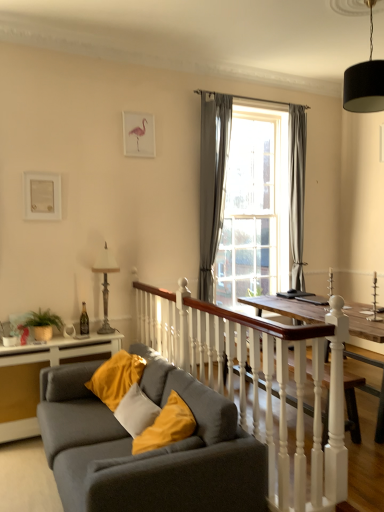
Question: Can you see gray fabric curtain at center, the second curtain from the back, touching black fabric lampshade at upper right?

Choices:
 (A) yes
 (B) no

Answer: (B)

Question: Does gray fabric curtain at center, the 1th curtain positioned from the front, have a greater width compared to black fabric lampshade at upper right?

Choices:
 (A) no
 (B) yes

Answer: (A)

Question: Does gray fabric curtain at center, the 1th curtain positioned from the front, appear on the left side of black fabric lampshade at upper right?

Choices:
 (A) yes
 (B) no

Answer: (A)

Question: From the image's perspective, is gray fabric curtain at center, arranged as the second curtain when viewed from the right, located beneath black fabric lampshade at upper right?

Choices:
 (A) yes
 (B) no

Answer: (A)

Question: Is gray fabric curtain at center, arranged as the second curtain when viewed from the right, positioned with its back to black fabric lampshade at upper right?

Choices:
 (A) yes
 (B) no

Answer: (B)

Question: Would you say metallic silver lamp at left is to the left or to the right of white matte picture frame at upper left, the 1th picture frame from the bottom, in the picture?

Choices:
 (A) left
 (B) right

Answer: (B)

Question: Based on their sizes in the image, would you say metallic silver lamp at left is bigger or smaller than white matte picture frame at upper left, which is counted as the second picture frame, starting from the top?

Choices:
 (A) big
 (B) small

Answer: (A)

Question: In the image, is metallic silver lamp at left positioned in front of or behind white matte picture frame at upper left, which is the 2th picture frame in right-to-left order?

Choices:
 (A) front
 (B) behind

Answer: (B)

Question: Do you think metallic silver lamp at left is within white matte picture frame at upper left, which is counted as the second picture frame, starting from the top, or outside of it?

Choices:
 (A) outside
 (B) inside

Answer: (A)

Question: From a real-world perspective, is white matte picture frame at upper left, the 1th picture frame from the bottom, physically located above or below black fabric lampshade at upper right?

Choices:
 (A) below
 (B) above

Answer: (A)

Question: From the image's perspective, is white matte picture frame at upper left, the 1th picture frame from the bottom, above or below black fabric lampshade at upper right?

Choices:
 (A) above
 (B) below

Answer: (B)

Question: Looking at their shapes, would you say white matte picture frame at upper left, which is the 2th picture frame from back to front, is wider or thinner than black fabric lampshade at upper right?

Choices:
 (A) thin
 (B) wide

Answer: (A)

Question: Is white matte picture frame at upper left, which is counted as the second picture frame, starting from the top, taller or shorter than black fabric lampshade at upper right?

Choices:
 (A) short
 (B) tall

Answer: (A)

Question: Is metallic silver lamp at left wider or thinner than pink paper picture frame at upper center, which ranks as the second picture frame in front-to-back order?

Choices:
 (A) thin
 (B) wide

Answer: (B)

Question: Is metallic silver lamp at left in front of or behind pink paper picture frame at upper center, the 1th picture frame viewed from the back, in the image?

Choices:
 (A) front
 (B) behind

Answer: (A)